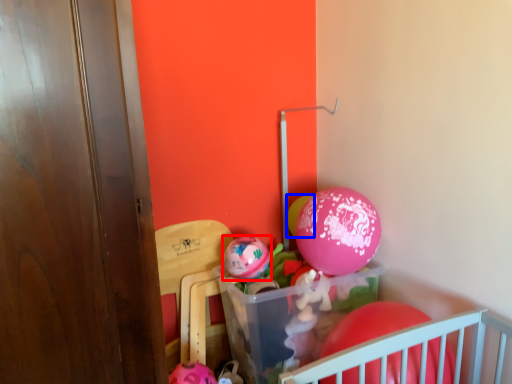
Question: Which object appears farthest to the camera in this image, balloon (highlighted by a red box) or balloon (highlighted by a blue box)?

Choices:
 (A) balloon
 (B) balloon

Answer: (B)